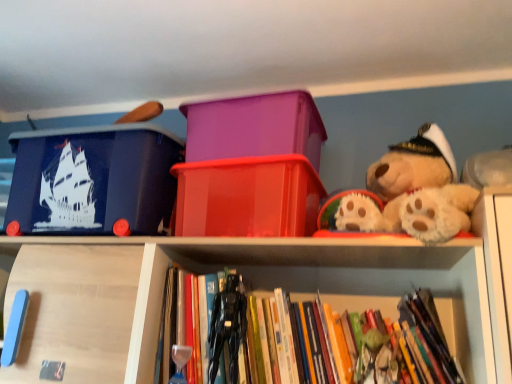
The image size is (512, 384). Find the location of `black plastic action figure at center`. black plastic action figure at center is located at coordinates click(227, 327).

Image resolution: width=512 pixels, height=384 pixels. Find the location of `translucent red plastic container at center, the second storage box viewed from the left`. translucent red plastic container at center, the second storage box viewed from the left is located at coordinates (248, 197).

This screenshot has width=512, height=384. I want to click on matte blue plastic storage box at upper left, the 1th storage box from the left, so click(93, 179).

Considering the sizes of objects matte blue plastic storage box at upper left, the third storage box in the right-to-left sequence, and translucent red plastic container at center, the second storage box viewed from the left, in the image provided, who is wider, matte blue plastic storage box at upper left, the third storage box in the right-to-left sequence, or translucent red plastic container at center, the second storage box viewed from the left,?

Wider between the two is translucent red plastic container at center, the second storage box viewed from the left.

Where is `storage box that is the 1st one when counting upward from the translucent red plastic container at center, the second storage box viewed from the left (from the image's perspective)`? storage box that is the 1st one when counting upward from the translucent red plastic container at center, the second storage box viewed from the left (from the image's perspective) is located at coordinates (93, 179).

Which object is positioned more to the right, matte blue plastic storage box at upper left, the third storage box in the right-to-left sequence, or translucent red plastic container at center, acting as the second storage box starting from the right?

translucent red plastic container at center, acting as the second storage box starting from the right, is more to the right.

Is point (19, 203) more distant than point (272, 166)?

Yes, it is.

How much distance is there between translucent red plastic container at center, the second storage box viewed from the left, and black plastic action figure at center?

9.07 inches.

From a real-world perspective, which is physically above, translucent red plastic container at center, acting as the second storage box starting from the right, or black plastic action figure at center?

From a 3D spatial view, translucent red plastic container at center, acting as the second storage box starting from the right, is above.

From the image's perspective, would you say translucent red plastic container at center, the second storage box viewed from the left, is shown under black plastic action figure at center?

Incorrect, from the image's perspective, translucent red plastic container at center, the second storage box viewed from the left, is higher than black plastic action figure at center.

Can you confirm if translucent red plastic container at center, acting as the second storage box starting from the right, is positioned to the right of black plastic action figure at center?

Yes, translucent red plastic container at center, acting as the second storage box starting from the right, is to the right of black plastic action figure at center.

Is purple plastic storage box at center, marked as the first storage box in a right-to-left arrangement, not close to black plastic action figure at center?

No, purple plastic storage box at center, marked as the first storage box in a right-to-left arrangement, is not far away from black plastic action figure at center.

From the image's perspective, is purple plastic storage box at center, marked as the first storage box in a right-to-left arrangement, located beneath black plastic action figure at center?

Actually, purple plastic storage box at center, marked as the first storage box in a right-to-left arrangement, appears above black plastic action figure at center in the image.

Which of these two, purple plastic storage box at center, marked as the first storage box in a right-to-left arrangement, or black plastic action figure at center, stands taller?

black plastic action figure at center is taller.

From a real-world perspective, does purple plastic storage box at center, which appears as the third storage box when viewed from the left, stand above black plastic action figure at center?

Indeed, from a real-world perspective, purple plastic storage box at center, which appears as the third storage box when viewed from the left, stands above black plastic action figure at center.

Are matte blue plastic storage box at upper left, the third storage box in the right-to-left sequence, and purple plastic storage box at center, marked as the first storage box in a right-to-left arrangement, far apart?

No, matte blue plastic storage box at upper left, the third storage box in the right-to-left sequence, is in close proximity to purple plastic storage box at center, marked as the first storage box in a right-to-left arrangement.

From a real-world perspective, is matte blue plastic storage box at upper left, the third storage box in the right-to-left sequence, under purple plastic storage box at center, which appears as the third storage box when viewed from the left?

Correct, in the physical world, matte blue plastic storage box at upper left, the third storage box in the right-to-left sequence, is lower than purple plastic storage box at center, which appears as the third storage box when viewed from the left.

Considering the positions of points (120, 166) and (278, 114), is point (120, 166) farther from camera compared to point (278, 114)?

Yes.

Is purple plastic storage box at center, marked as the first storage box in a right-to-left arrangement, in front of or behind matte blue plastic storage box at upper left, the third storage box in the right-to-left sequence, in the image?

Visually, purple plastic storage box at center, marked as the first storage box in a right-to-left arrangement, is located behind matte blue plastic storage box at upper left, the third storage box in the right-to-left sequence.

From a real-world perspective, who is located higher, purple plastic storage box at center, marked as the first storage box in a right-to-left arrangement, or matte blue plastic storage box at upper left, the 1th storage box from the left?

purple plastic storage box at center, marked as the first storage box in a right-to-left arrangement, is physically above.

Between purple plastic storage box at center, marked as the first storage box in a right-to-left arrangement, and matte blue plastic storage box at upper left, the third storage box in the right-to-left sequence, which one has larger size?

matte blue plastic storage box at upper left, the third storage box in the right-to-left sequence, is bigger.

Which point is more forward, (232,205) or (243,133)?

The point (232,205) is closer.

From the image's perspective, does translucent red plastic container at center, the second storage box viewed from the left, appear lower than purple plastic storage box at center, which appears as the third storage box when viewed from the left?

Yes, from the image's perspective, translucent red plastic container at center, the second storage box viewed from the left, is below purple plastic storage box at center, which appears as the third storage box when viewed from the left.

Is translucent red plastic container at center, the second storage box viewed from the left, closer to the viewer compared to purple plastic storage box at center, marked as the first storage box in a right-to-left arrangement?

That is True.

Between translucent red plastic container at center, the second storage box viewed from the left, and purple plastic storage box at center, which appears as the third storage box when viewed from the left, which one appears on the right side from the viewer's perspective?

Answer: purple plastic storage box at center, which appears as the third storage box when viewed from the left.

Can you confirm if purple plastic storage box at center, marked as the first storage box in a right-to-left arrangement, is positioned to the left of translucent red plastic container at center, the second storage box viewed from the left?

In fact, purple plastic storage box at center, marked as the first storage box in a right-to-left arrangement, is to the right of translucent red plastic container at center, the second storage box viewed from the left.

Relative to translucent red plastic container at center, the second storage box viewed from the left, is purple plastic storage box at center, marked as the first storage box in a right-to-left arrangement, in front or behind?

Visually, purple plastic storage box at center, marked as the first storage box in a right-to-left arrangement, is located behind translucent red plastic container at center, the second storage box viewed from the left.

The height and width of the screenshot is (384, 512). Identify the location of the 1st storage box counting from the left of the purple plastic storage box at center, marked as the first storage box in a right-to-left arrangement. (248, 197).

Is purple plastic storage box at center, which appears as the third storage box when viewed from the left, beside translucent red plastic container at center, acting as the second storage box starting from the right?

No, purple plastic storage box at center, which appears as the third storage box when viewed from the left, is not making contact with translucent red plastic container at center, acting as the second storage box starting from the right.

There is a translucent red plastic container at center, acting as the second storage box starting from the right. Where is `the 1st storage box above it (from a real-world perspective)`? the 1st storage box above it (from a real-world perspective) is located at coordinates (93, 179).

The image size is (512, 384). I want to click on toy on the left of translucent red plastic container at center, acting as the second storage box starting from the right, so click(x=227, y=327).

Estimate the real-world distances between objects in this image. Which object is closer to hardcover books at center, black plastic action figure at center or translucent red plastic container at center, the second storage box viewed from the left?

black plastic action figure at center is positioned closer to the anchor hardcover books at center.

When comparing their distances from translucent red plastic container at center, acting as the second storage box starting from the right, does hardcover books at center or matte blue plastic storage box at upper left, the 1th storage box from the left, seem closer?

Based on the image, matte blue plastic storage box at upper left, the 1th storage box from the left, appears to be nearer to translucent red plastic container at center, acting as the second storage box starting from the right.

Based on the photo, from the image, which object appears to be farther from hardcover books at center, black plastic action figure at center or matte blue plastic storage box at upper left, the third storage box in the right-to-left sequence?

matte blue plastic storage box at upper left, the third storage box in the right-to-left sequence, is further to hardcover books at center.

Based on their spatial positions, is matte blue plastic storage box at upper left, the 1th storage box from the left, or hardcover books at center further from purple plastic storage box at center, marked as the first storage box in a right-to-left arrangement?

hardcover books at center is further to purple plastic storage box at center, marked as the first storage box in a right-to-left arrangement.

Considering their positions, is hardcover books at center positioned further to translucent red plastic container at center, acting as the second storage box starting from the right, than purple plastic storage box at center, marked as the first storage box in a right-to-left arrangement?

hardcover books at center is further to translucent red plastic container at center, acting as the second storage box starting from the right.

When comparing their distances from hardcover books at center, does translucent red plastic container at center, acting as the second storage box starting from the right, or matte blue plastic storage box at upper left, the third storage box in the right-to-left sequence, seem further?

matte blue plastic storage box at upper left, the third storage box in the right-to-left sequence, is further to hardcover books at center.

When comparing their distances from black plastic action figure at center, does hardcover books at center or purple plastic storage box at center, marked as the first storage box in a right-to-left arrangement, seem further?

purple plastic storage box at center, marked as the first storage box in a right-to-left arrangement, lies further to black plastic action figure at center than the other object.

Estimate the real-world distances between objects in this image. Which object is further from translucent red plastic container at center, acting as the second storage box starting from the right, matte blue plastic storage box at upper left, the 1th storage box from the left, or purple plastic storage box at center, which appears as the third storage box when viewed from the left?

matte blue plastic storage box at upper left, the 1th storage box from the left, is further to translucent red plastic container at center, acting as the second storage box starting from the right.

Where is `toy located between matte blue plastic storage box at upper left, the 1th storage box from the left, and hardcover books at center in the left-right direction`? This screenshot has width=512, height=384. toy located between matte blue plastic storage box at upper left, the 1th storage box from the left, and hardcover books at center in the left-right direction is located at coordinates (227, 327).

In order to click on toy between purple plastic storage box at center, which appears as the third storage box when viewed from the left, and hardcover books at center from top to bottom in this screenshot , I will do `click(227, 327)`.

Where is `toy that lies between translucent red plastic container at center, the second storage box viewed from the left, and hardcover books at center from top to bottom`? This screenshot has height=384, width=512. toy that lies between translucent red plastic container at center, the second storage box viewed from the left, and hardcover books at center from top to bottom is located at coordinates (227, 327).

Find the location of a particular element. Image resolution: width=512 pixels, height=384 pixels. toy between matte blue plastic storage box at upper left, the 1th storage box from the left, and purple plastic storage box at center, which appears as the third storage box when viewed from the left is located at coordinates (227, 327).